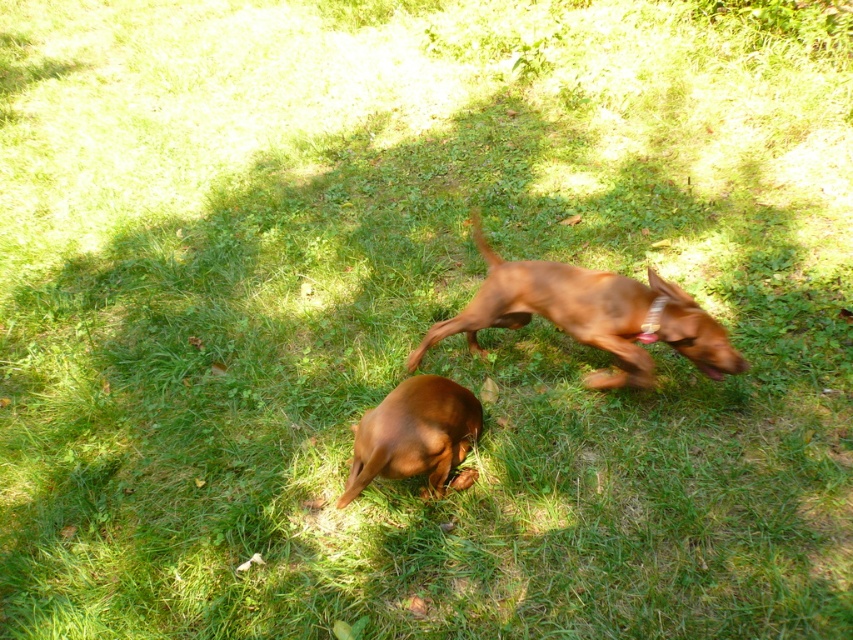
You are a photographer trying to capture both the brown glossy dog at upper center and the shiny brown dog at center in a single frame. Based on their positions and sizes, which dog should you focus on first to ensure both are in the frame?

The brown glossy dog at upper center is wider than the shiny brown dog at center, so focusing on the brown glossy dog at upper center first will help ensure both are in the frame.

You are a photographer trying to capture a photo of both the brown glossy dog at upper center and the shiny brown dog at center. Since you want to focus on the closer dog, which one should you aim your camera at?

The brown glossy dog at upper center is closer to the viewer, so you should aim your camera at it to focus on the closer dog.